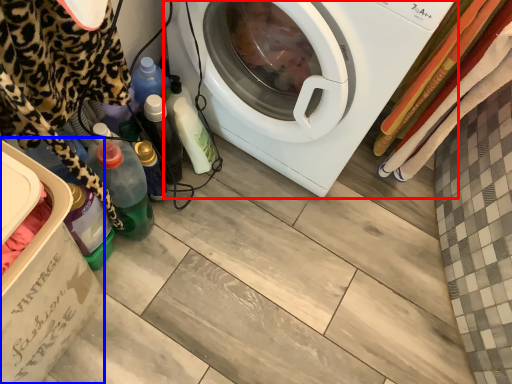
Question: Among these objects, which one is nearest to the camera, washing machine (highlighted by a red box) or dish washer (highlighted by a blue box)?

Choices:
 (A) washing machine
 (B) dish washer

Answer: (B)